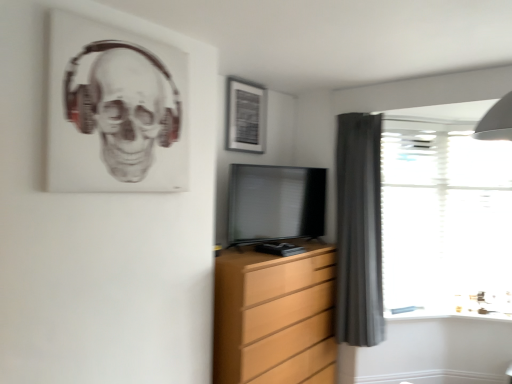
Question: Is transparent glass door at right not near matte black tv at center?

Choices:
 (A) yes
 (B) no

Answer: (B)

Question: From a real-world perspective, is transparent glass door at right physically below matte black tv at center?

Choices:
 (A) yes
 (B) no

Answer: (A)

Question: Does transparent glass door at right appear on the right side of matte black tv at center?

Choices:
 (A) no
 (B) yes

Answer: (B)

Question: Is transparent glass door at right touching matte black tv at center?

Choices:
 (A) yes
 (B) no

Answer: (B)

Question: Does transparent glass door at right have a larger size compared to matte black tv at center?

Choices:
 (A) no
 (B) yes

Answer: (B)

Question: Is transparent glass door at right in front of matte black tv at center?

Choices:
 (A) no
 (B) yes

Answer: (A)

Question: Is wooden chest of drawers at center aimed at dark gray fabric curtain at right?

Choices:
 (A) yes
 (B) no

Answer: (B)

Question: Does wooden chest of drawers at center have a lesser width compared to dark gray fabric curtain at right?

Choices:
 (A) yes
 (B) no

Answer: (B)

Question: Considering the relative sizes of wooden chest of drawers at center and dark gray fabric curtain at right in the image provided, is wooden chest of drawers at center bigger than dark gray fabric curtain at right?

Choices:
 (A) yes
 (B) no

Answer: (A)

Question: Does wooden chest of drawers at center come behind dark gray fabric curtain at right?

Choices:
 (A) yes
 (B) no

Answer: (B)

Question: From a real-world perspective, is wooden chest of drawers at center over dark gray fabric curtain at right?

Choices:
 (A) no
 (B) yes

Answer: (A)

Question: Does wooden chest of drawers at center appear on the right side of dark gray fabric curtain at right?

Choices:
 (A) no
 (B) yes

Answer: (A)

Question: Is matte black tv at center positioned before dark gray fabric curtain at right?

Choices:
 (A) no
 (B) yes

Answer: (B)